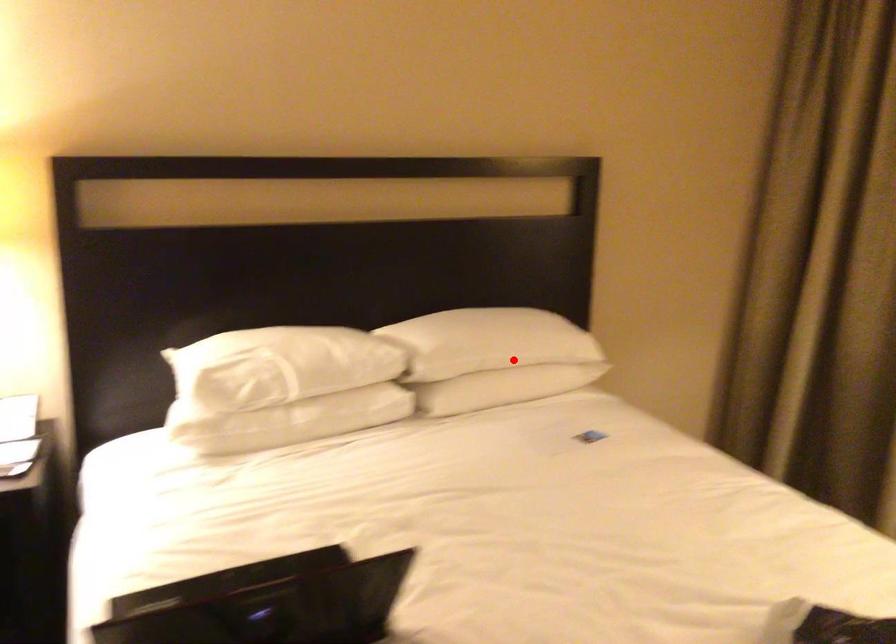
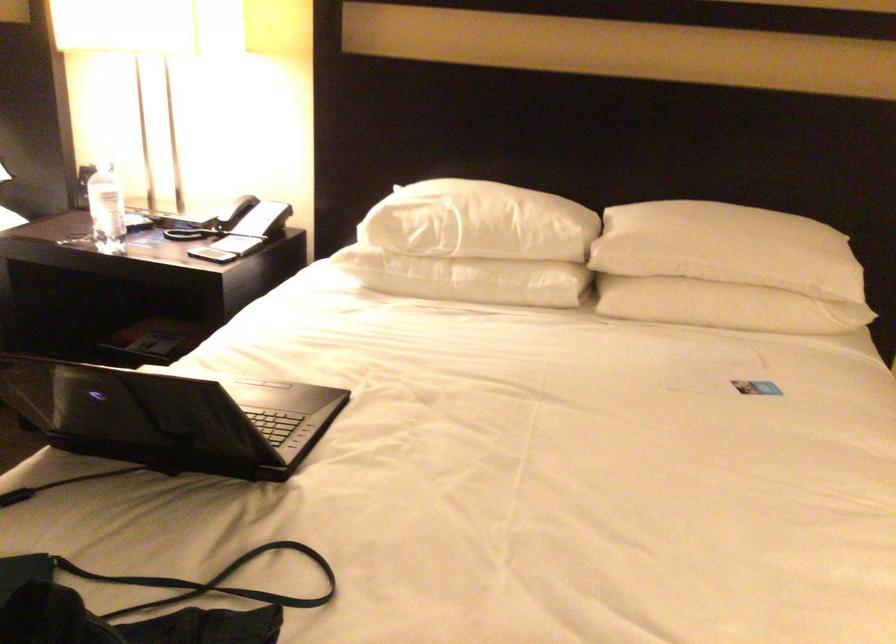
Locate, in the second image, the point that corresponds to the highlighted location in the first image.

(727, 269)